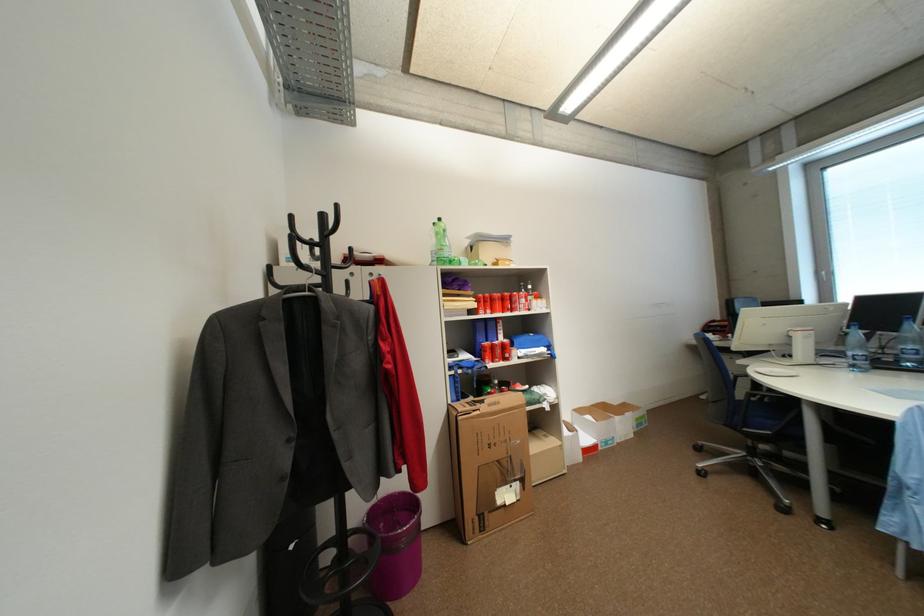
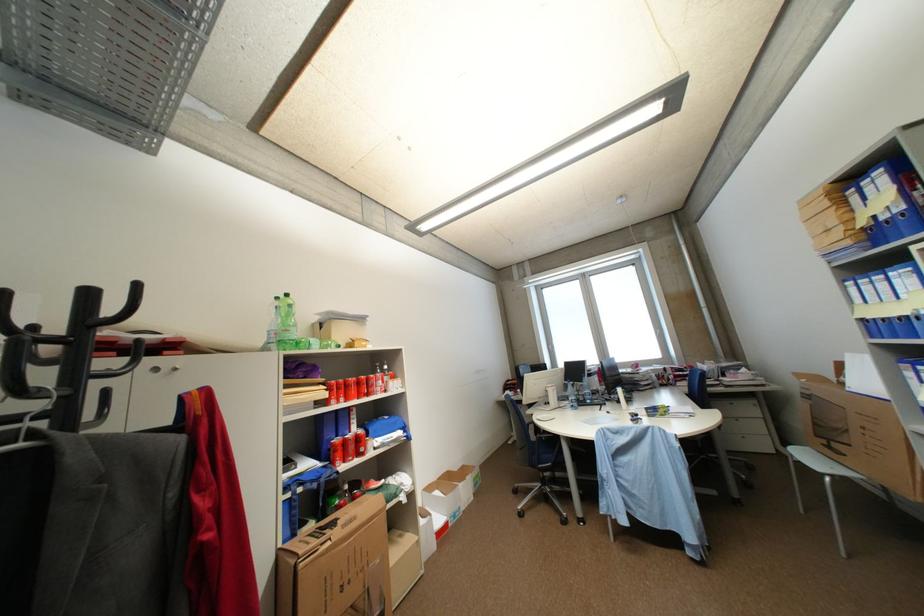
The point at (443,225) is marked in the first image. Where is the corresponding point in the second image?

(286, 300)